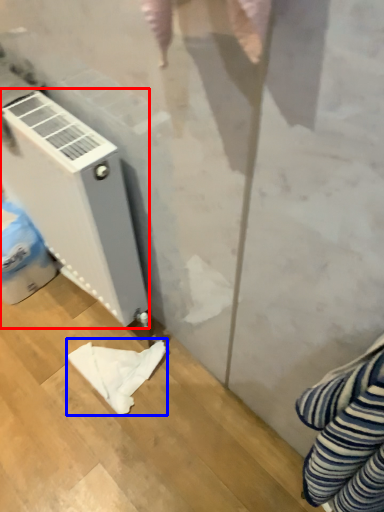
Question: Among these objects, which one is farthest to the camera, home appliance (highlighted by a red box) or cloth (highlighted by a blue box)?

Choices:
 (A) home appliance
 (B) cloth

Answer: (B)